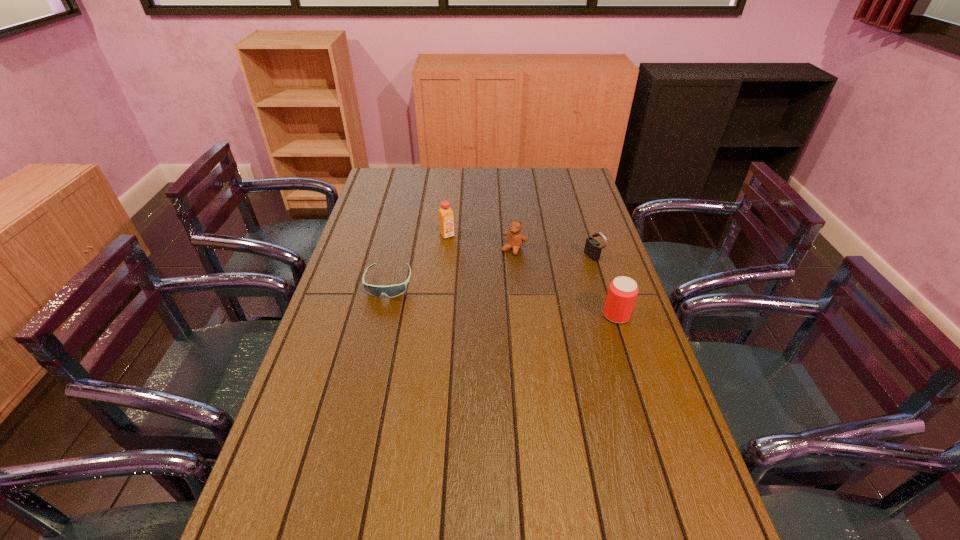
Identify the location of goggles. tap(395, 290).

Locate an element on the screen. the shortest object is located at coordinates tap(395, 290).

I want to click on the nearest object, so click(623, 291).

Find the location of `padlock`. padlock is located at coordinates (593, 248).

The image size is (960, 540). I want to click on the third object from right to left, so click(x=515, y=238).

Identify the location of orange juice. Image resolution: width=960 pixels, height=540 pixels. (446, 223).

The height and width of the screenshot is (540, 960). Identify the location of the farthest object. (446, 223).

Identify the location of vacant space positioned on the front-facing side of the leftmost object. Image resolution: width=960 pixels, height=540 pixels. (375, 340).

I want to click on free region located 0.390m on the left of the beer can, so click(x=471, y=315).

This screenshot has width=960, height=540. In order to click on vacant space situated with the keyhole on the front of the padlock in this screenshot , I will do `click(520, 283)`.